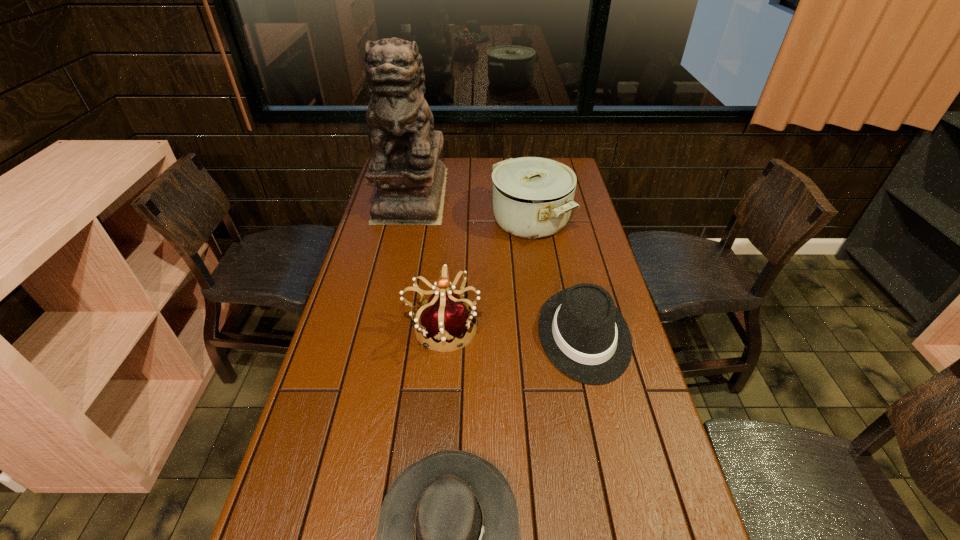
What are the coordinates of `saucepan located in the right edge section of the desktop` in the screenshot? It's located at point(533,197).

Image resolution: width=960 pixels, height=540 pixels. Identify the location of fedora located at the right edge. (585, 336).

Where is `object present at the far left corner`? This screenshot has width=960, height=540. object present at the far left corner is located at coordinates (405, 167).

Where is `vacant region at the far edge`? The width and height of the screenshot is (960, 540). vacant region at the far edge is located at coordinates (497, 160).

Identify the location of free spot at the left edge of the desktop. The image size is (960, 540). (388, 274).

Identify the location of vacant space at the right edge of the desktop. (603, 453).

Where is `empty space between the fedora and the saucepan`? empty space between the fedora and the saucepan is located at coordinates (557, 278).

Identify the location of empty space between the tiara and the fedora. (514, 332).

Find the location of a particular element. Image resolution: width=960 pixels, height=540 pixels. object that is the closest one to the tallest object is located at coordinates (533, 197).

Identify the location of the closest object relative to the tallest object. The height and width of the screenshot is (540, 960). (533, 197).